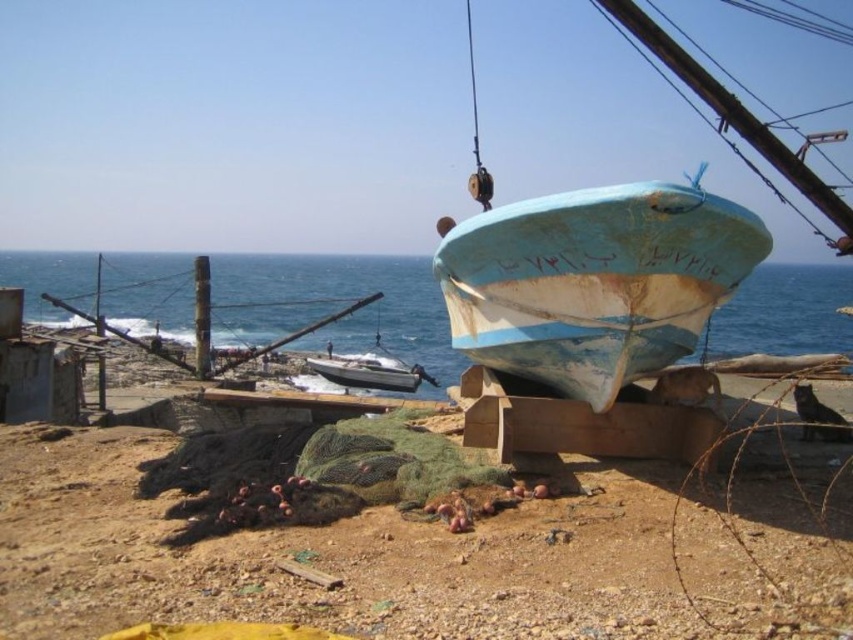
Which is more to the right, rusty blue boat at center or blue painted wood boat at center?

From the viewer's perspective, rusty blue boat at center appears more on the right side.

Is rusty blue boat at center positioned in front of blue painted wood boat at center?

Yes.

Who is more distant from viewer, (641,246) or (837,337)?

Point (837,337)

This screenshot has width=853, height=640. I want to click on rusty blue boat at center, so click(x=595, y=282).

Is rusty blue boat at center smaller than white glossy boat at center?

Correct, rusty blue boat at center occupies less space than white glossy boat at center.

Find the location of `rusty blue boat at center`. rusty blue boat at center is located at coordinates (x=595, y=282).

Does blue painted wood boat at center have a lesser height compared to white glossy boat at center?

No, blue painted wood boat at center is not shorter than white glossy boat at center.

Locate an element on the screen. This screenshot has height=640, width=853. blue painted wood boat at center is located at coordinates 335,305.

The image size is (853, 640). In order to click on blue painted wood boat at center in this screenshot , I will do `click(335, 305)`.

I want to click on blue painted wood boat at center, so click(335, 305).